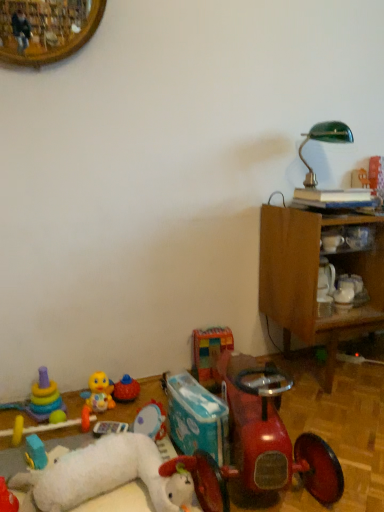
Question: Is plush yellow duck at lower left, the sixth toy viewed from the right, directly adjacent to multicolored fabric blocks at center, acting as the second toy starting from the right?

Choices:
 (A) no
 (B) yes

Answer: (A)

Question: From a real-world perspective, is plush yellow duck at lower left, arranged as the fifth toy when viewed from the left, beneath multicolored fabric blocks at center, which appears as the ninth toy when viewed from the left?

Choices:
 (A) yes
 (B) no

Answer: (A)

Question: Considering the relative sizes of plush yellow duck at lower left, arranged as the fifth toy when viewed from the left, and multicolored fabric blocks at center, which appears as the ninth toy when viewed from the left, in the image provided, is plush yellow duck at lower left, arranged as the fifth toy when viewed from the left, bigger than multicolored fabric blocks at center, which appears as the ninth toy when viewed from the left,?

Choices:
 (A) no
 (B) yes

Answer: (A)

Question: Is plush yellow duck at lower left, the sixth toy viewed from the right, aimed at multicolored fabric blocks at center, which appears as the ninth toy when viewed from the left?

Choices:
 (A) yes
 (B) no

Answer: (B)

Question: Is plush yellow duck at lower left, arranged as the fifth toy when viewed from the left, outside of multicolored fabric blocks at center, acting as the second toy starting from the right?

Choices:
 (A) yes
 (B) no

Answer: (A)

Question: Considering the positions of point (3, 482) and point (125, 400), is point (3, 482) closer or farther from the camera than point (125, 400)?

Choices:
 (A) farther
 (B) closer

Answer: (B)

Question: In terms of size, does rubber duck at lower left, which is the 10th toy in right-to-left order, appear bigger or smaller than rubberized orange ball at center, the 7th toy positioned from the left?

Choices:
 (A) big
 (B) small

Answer: (A)

Question: In the image, is rubber duck at lower left, which is the 1th toy in left-to-right order, on the left side or the right side of rubberized orange ball at center, the 7th toy positioned from the left?

Choices:
 (A) right
 (B) left

Answer: (B)

Question: In terms of width, does rubber duck at lower left, which is the 1th toy in left-to-right order, look wider or thinner when compared to rubberized orange ball at center, which ranks as the fourth toy in right-to-left order?

Choices:
 (A) thin
 (B) wide

Answer: (B)

Question: From a real-world perspective, is shiny red toy car at lower right positioned above or below wooden cabinet at right?

Choices:
 (A) below
 (B) above

Answer: (A)

Question: Is shiny red toy car at lower right spatially inside wooden cabinet at right, or outside of it?

Choices:
 (A) inside
 (B) outside

Answer: (B)

Question: From the image's perspective, is shiny red toy car at lower right positioned above or below wooden cabinet at right?

Choices:
 (A) above
 (B) below

Answer: (B)

Question: Based on their sizes in the image, would you say shiny red toy car at lower right is bigger or smaller than wooden cabinet at right?

Choices:
 (A) small
 (B) big

Answer: (A)

Question: Relative to plush yellow duck at lower left, the sixth toy viewed from the right, is multicolored fabric blocks at center, acting as the second toy starting from the right, in front or behind?

Choices:
 (A) behind
 (B) front

Answer: (A)

Question: In terms of height, does multicolored fabric blocks at center, which appears as the ninth toy when viewed from the left, look taller or shorter compared to plush yellow duck at lower left, the sixth toy viewed from the right?

Choices:
 (A) tall
 (B) short

Answer: (A)